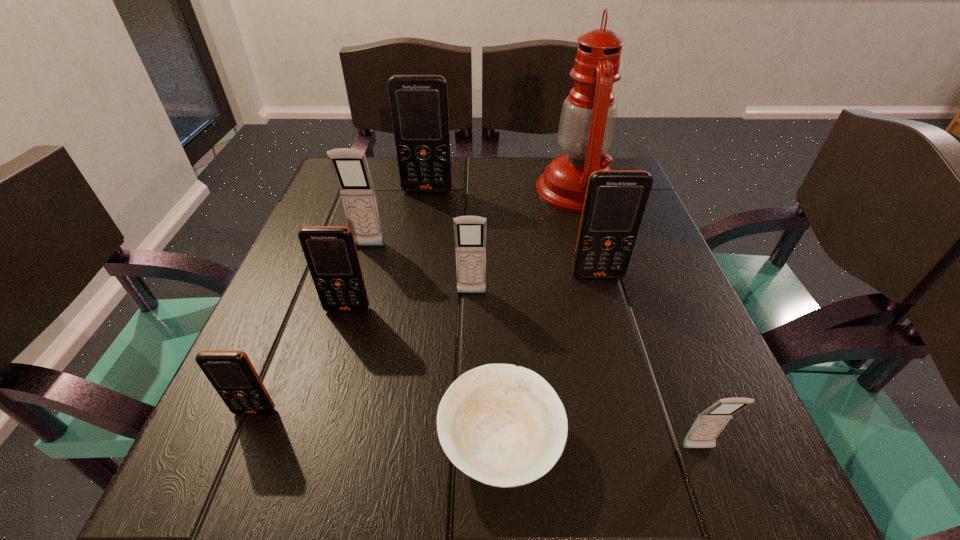
Where is `oil lamp`? This screenshot has height=540, width=960. oil lamp is located at coordinates (588, 117).

The image size is (960, 540). What are the coordinates of `the biggest orange cellular telephone` in the screenshot? It's located at (419, 103).

This screenshot has width=960, height=540. What are the coordinates of `the fourth cellular telephone from right to left` in the screenshot? It's located at (419, 103).

The height and width of the screenshot is (540, 960). Identify the location of the biggest gray cellular telephone. (350, 166).

What are the coordinates of `the sixth nearest cellular telephone` in the screenshot? It's located at (350, 166).

The height and width of the screenshot is (540, 960). Find the location of `the rightmost orange cellular telephone`. the rightmost orange cellular telephone is located at coordinates (615, 201).

Find the location of `the sixth nearest object`. the sixth nearest object is located at coordinates (615, 201).

At what (x,y) coordinates should I click in order to perform the action: click on the second farthest gray cellular telephone. Please return your answer as a coordinate pair (x, y). The image size is (960, 540). Looking at the image, I should click on (470, 231).

Locate an element on the screen. the second gray cellular telephone from right to left is located at coordinates (470, 231).

Identify the location of the third orange cellular telephone from right to left. (330, 251).